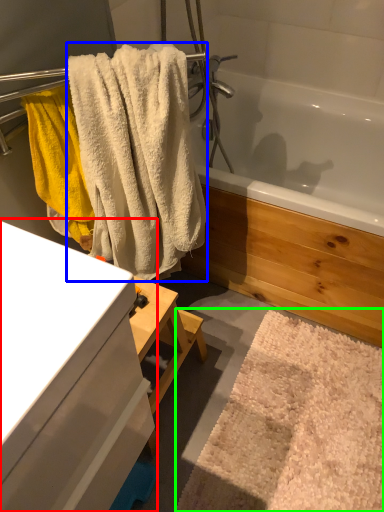
Question: Which object is positioned farthest from bathroom cabinet (highlighted by a red box)? Select from towel (highlighted by a blue box) and bath mat (highlighted by a green box).

Choices:
 (A) towel
 (B) bath mat

Answer: (B)